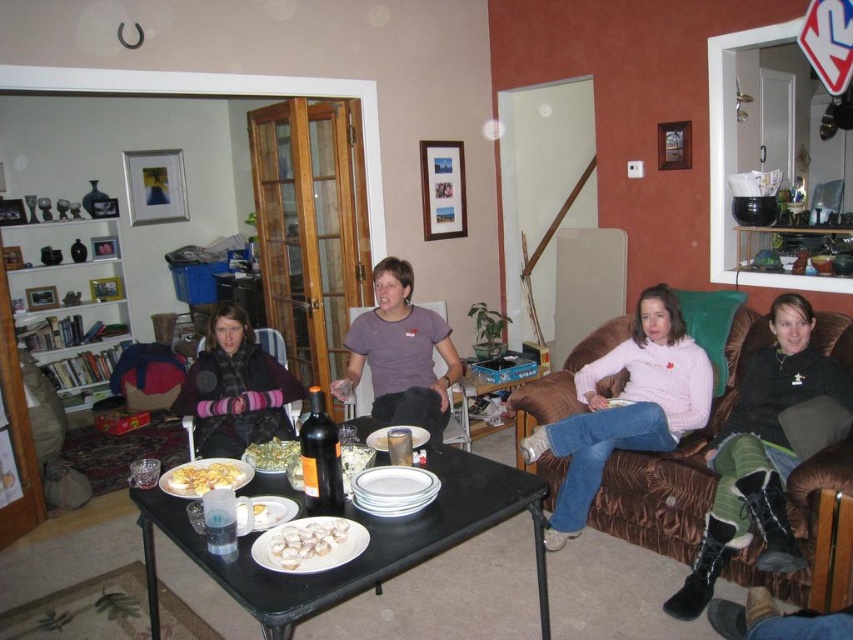
Can you confirm if brown fabric couch at right is positioned to the right of green leafy salad at center?

Correct, you'll find brown fabric couch at right to the right of green leafy salad at center.

Image resolution: width=853 pixels, height=640 pixels. What are the coordinates of `brown fabric couch at right` in the screenshot? It's located at (726, 461).

Describe the element at coordinates (726, 461) in the screenshot. The width and height of the screenshot is (853, 640). I see `brown fabric couch at right` at that location.

Find the location of `brown fabric couch at right`. brown fabric couch at right is located at coordinates (726, 461).

Is brown fabric couch at right to the right of yellow matte plate at center from the viewer's perspective?

Indeed, brown fabric couch at right is positioned on the right side of yellow matte plate at center.

Is brown fabric couch at right closer to camera compared to yellow matte plate at center?

No, brown fabric couch at right is behind yellow matte plate at center.

Which is behind, point (827, 403) or point (242, 470)?

The point (827, 403) is more distant.

Image resolution: width=853 pixels, height=640 pixels. I want to click on brown fabric couch at right, so click(726, 461).

Who is more forward, [526,461] or [390,339]?

Positioned in front is point [526,461].

Between point (688, 337) and point (357, 349), which one is positioned in front?

Point (688, 337) is more forward.

Where is `pink fleece sweater at center`? This screenshot has width=853, height=640. pink fleece sweater at center is located at coordinates (625, 406).